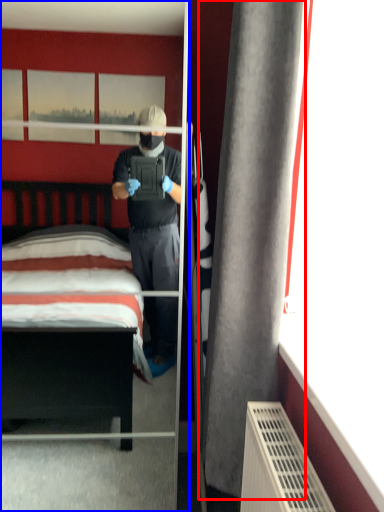
Question: Which object is closer to the camera taking this photo, curtain (highlighted by a red box) or mirror (highlighted by a blue box)?

Choices:
 (A) curtain
 (B) mirror

Answer: (A)